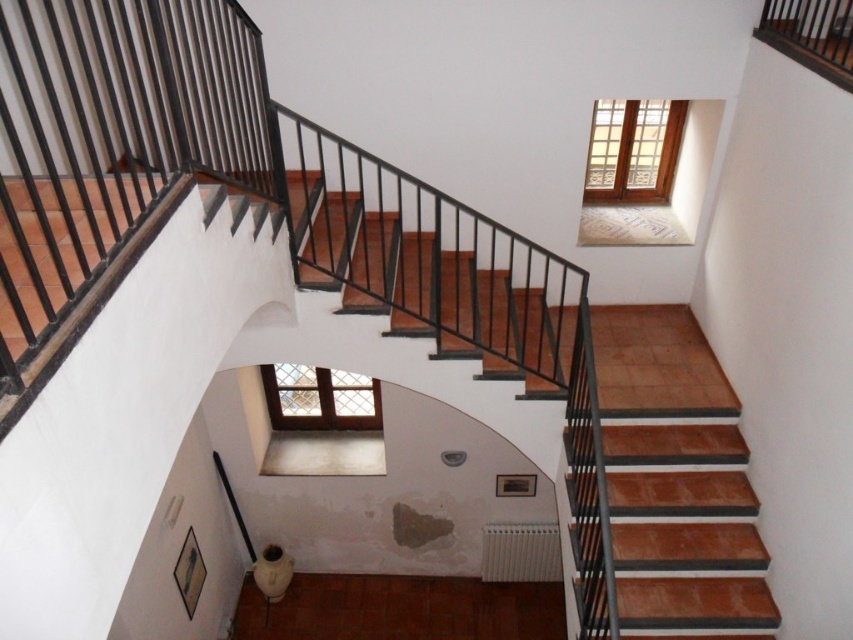
Question: Can you confirm if clear glass window at upper right is positioned to the left of clear glass window at center?

Choices:
 (A) yes
 (B) no

Answer: (B)

Question: Can you confirm if clear glass window at upper right is bigger than clear glass window at center?

Choices:
 (A) yes
 (B) no

Answer: (B)

Question: Which point is closer to the camera?

Choices:
 (A) clear glass window at center
 (B) clear glass window at upper right

Answer: (B)

Question: Can you confirm if clear glass window at upper right is positioned above clear glass window at center?

Choices:
 (A) no
 (B) yes

Answer: (B)